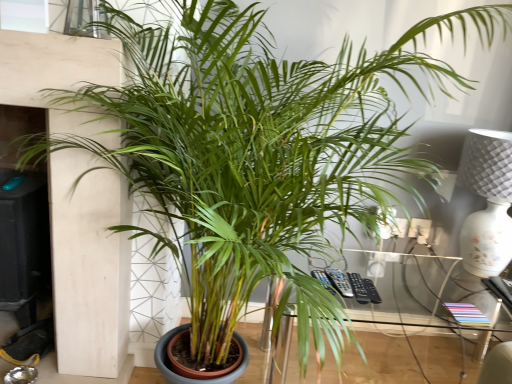
Question: Is white textured lamp at right placed right next to clear glass window at upper center?

Choices:
 (A) no
 (B) yes

Answer: (A)

Question: Considering the relative positions of white textured lamp at right and clear glass window at upper center in the image provided, is white textured lamp at right to the right of clear glass window at upper center from the viewer's perspective?

Choices:
 (A) yes
 (B) no

Answer: (A)

Question: Considering the relative sizes of white textured lamp at right and clear glass window at upper center in the image provided, is white textured lamp at right wider than clear glass window at upper center?

Choices:
 (A) no
 (B) yes

Answer: (B)

Question: Could you tell me if white textured lamp at right is facing clear glass window at upper center?

Choices:
 (A) no
 (B) yes

Answer: (A)

Question: Can you confirm if white textured lamp at right is bigger than clear glass window at upper center?

Choices:
 (A) yes
 (B) no

Answer: (A)

Question: Is the position of white textured lamp at right more distant than that of clear glass window at upper center?

Choices:
 (A) no
 (B) yes

Answer: (B)

Question: Does transparent glass table at center turn towards clear glass window at upper center?

Choices:
 (A) no
 (B) yes

Answer: (A)

Question: Is transparent glass table at center thinner than clear glass window at upper center?

Choices:
 (A) no
 (B) yes

Answer: (A)

Question: Does transparent glass table at center lie behind clear glass window at upper center?

Choices:
 (A) no
 (B) yes

Answer: (B)

Question: Can you confirm if transparent glass table at center is smaller than clear glass window at upper center?

Choices:
 (A) no
 (B) yes

Answer: (A)

Question: Considering the relative sizes of transparent glass table at center and clear glass window at upper center in the image provided, is transparent glass table at center wider than clear glass window at upper center?

Choices:
 (A) no
 (B) yes

Answer: (B)

Question: Is transparent glass table at center taller than clear glass window at upper center?

Choices:
 (A) yes
 (B) no

Answer: (A)

Question: Is transparent glass table at center to the left of white textured lamp at right from the viewer's perspective?

Choices:
 (A) no
 (B) yes

Answer: (B)